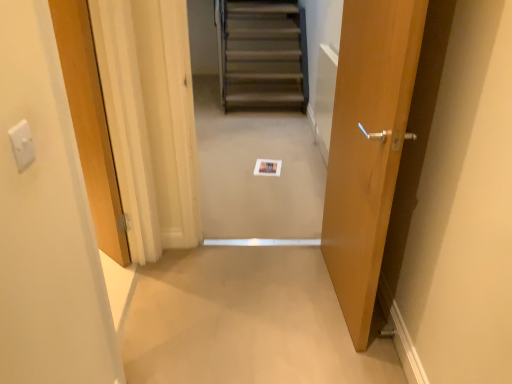
Identify the location of free region under matte wood door at right, which is the 2th door in left-to-right order (from a real-world perspective). The image size is (512, 384). (331, 297).